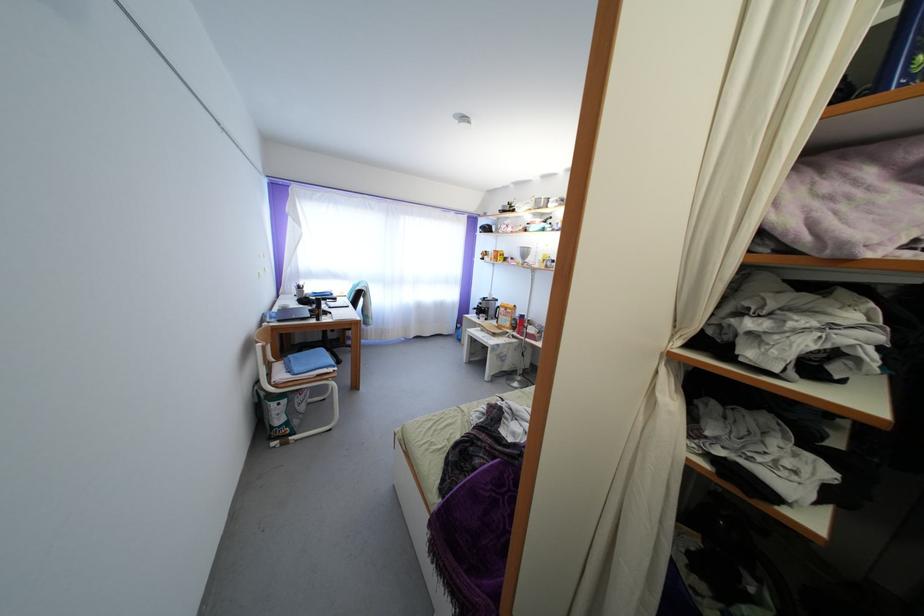
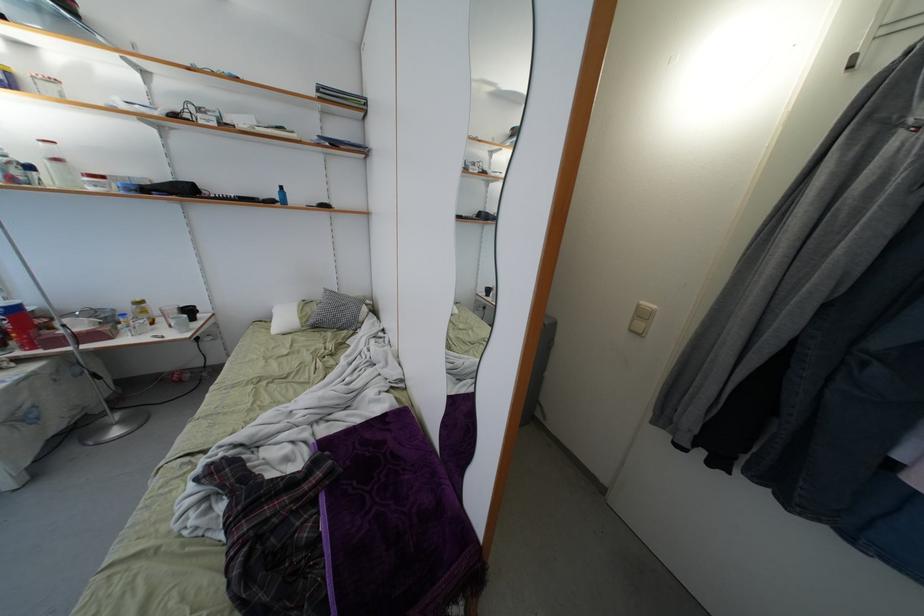
In the second image, find the point that corresponds to (525,330) in the first image.

(22, 333)